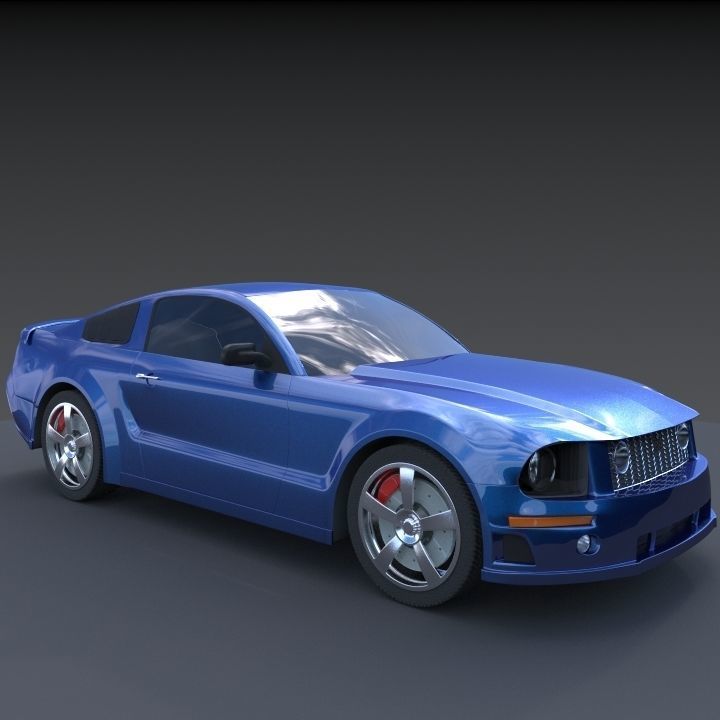
Where is `wall`? wall is located at coordinates pyautogui.click(x=369, y=88).